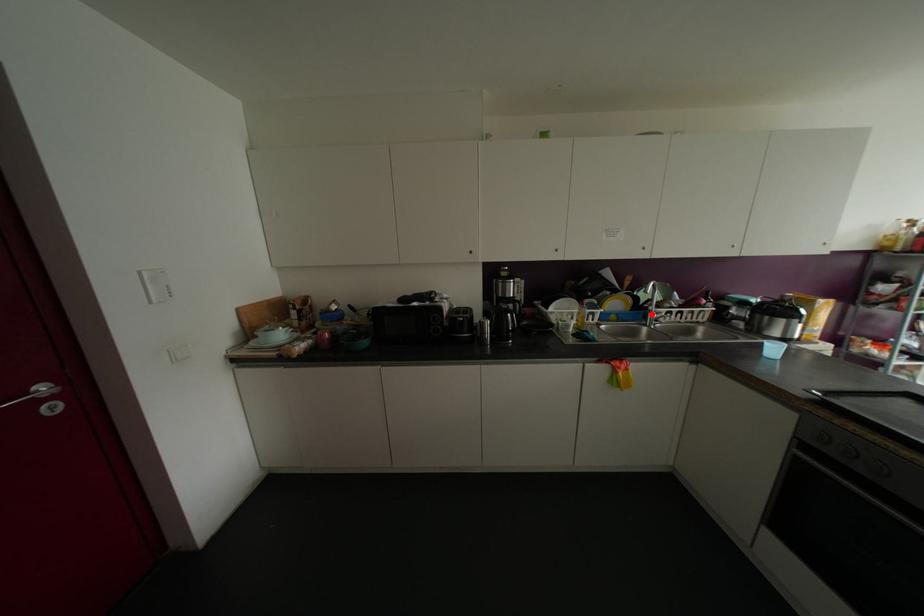
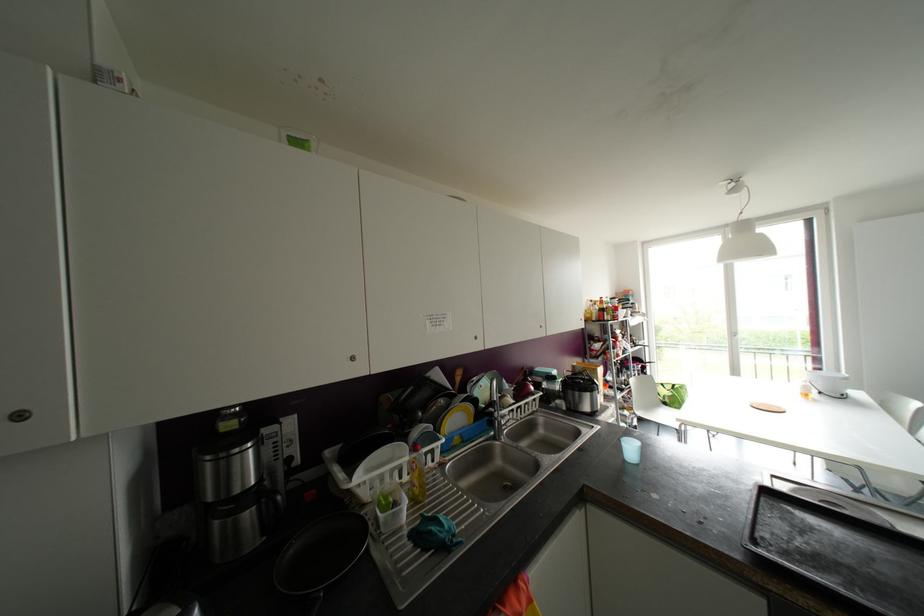
Question: A red point is marked in image1. In image2, is the corresponding 3D point closer to the camera or farther? Reply with the corresponding letter.

Choices:
 (A) The corresponding 3D point is closer.
 (B) The corresponding 3D point is farther.

Answer: (B)